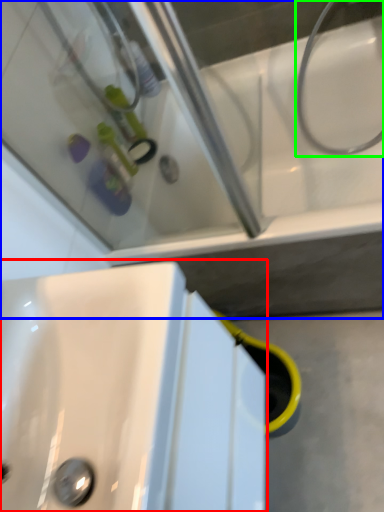
Question: Estimate the real-world distances between objects in this image. Which object is closer to sink (highlighted by a red box), bath (highlighted by a blue box) or plumbing fixture (highlighted by a green box)?

Choices:
 (A) bath
 (B) plumbing fixture

Answer: (A)